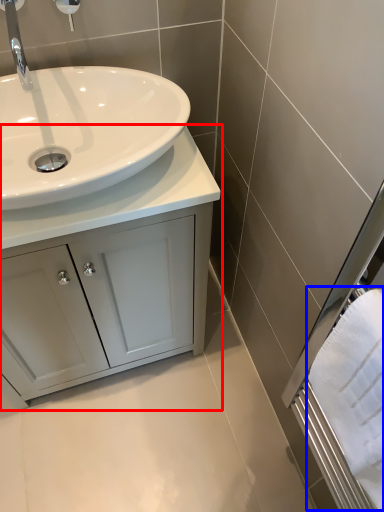
Question: Which of the following is the farthest to the observer, bathroom cabinet (highlighted by a red box) or bath towel (highlighted by a blue box)?

Choices:
 (A) bathroom cabinet
 (B) bath towel

Answer: (A)